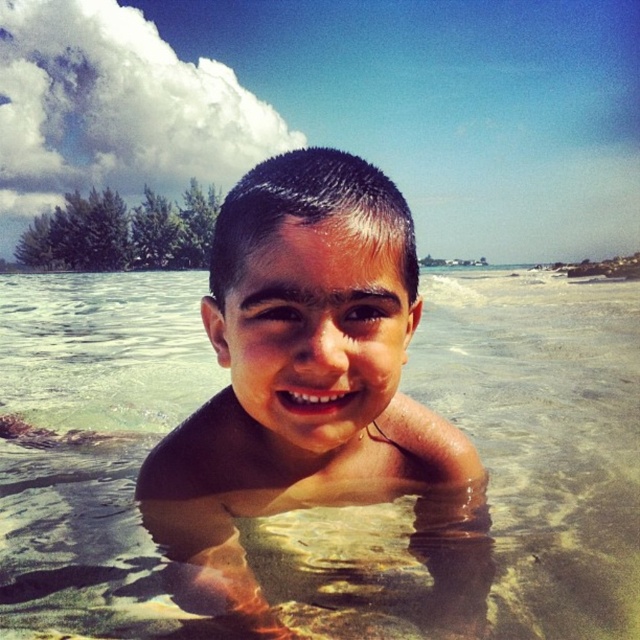
Question: Is clear water at center smaller than smooth skin child at center?

Choices:
 (A) yes
 (B) no

Answer: (B)

Question: Is clear water at center to the right of smooth skin child at center from the viewer's perspective?

Choices:
 (A) no
 (B) yes

Answer: (A)

Question: In this image, where is clear water at center located relative to smooth skin child at center?

Choices:
 (A) left
 (B) right

Answer: (A)

Question: Which point is closer to the camera taking this photo?

Choices:
 (A) (305, 396)
 (B) (474, 440)

Answer: (A)

Question: Which point is closer to the camera?

Choices:
 (A) smooth skin child at center
 (B) clear water at center

Answer: (A)